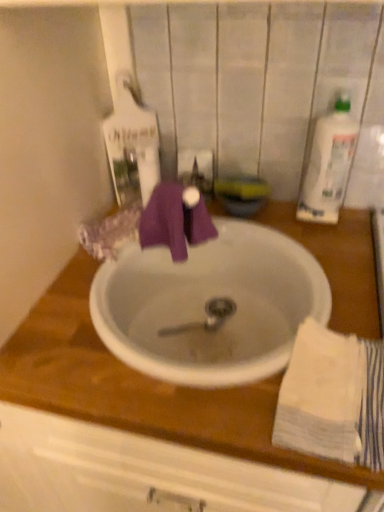
Locate an element on the screen. vacant space behind white cotton towel at lower right is located at coordinates (x=342, y=305).